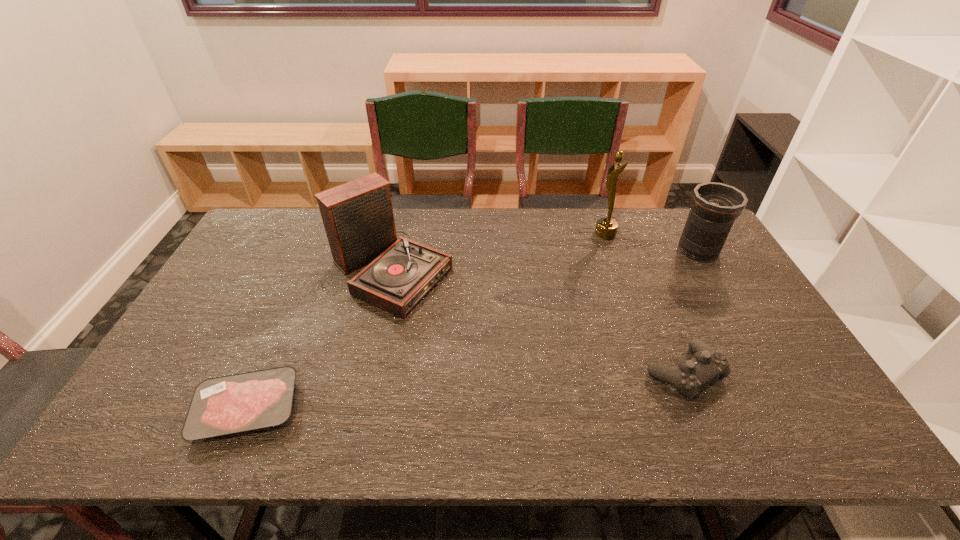
What are the coordinates of `free space located on the front of the telephoto lens` in the screenshot? It's located at (767, 368).

Where is `free space located on the back of the second shortest object`? The image size is (960, 540). free space located on the back of the second shortest object is located at coordinates (639, 265).

Identify the location of vacant region located 0.100m on the left of the shortest object. The height and width of the screenshot is (540, 960). (151, 408).

Image resolution: width=960 pixels, height=540 pixels. I want to click on award positioned at the far edge, so click(606, 228).

Identify the location of phonograph record that is positioned at the far edge. This screenshot has height=540, width=960. (358, 218).

Image resolution: width=960 pixels, height=540 pixels. I want to click on telephoto lens situated at the far edge, so click(x=715, y=206).

The height and width of the screenshot is (540, 960). Find the location of `object located at the near edge`. object located at the near edge is located at coordinates (237, 403).

I want to click on object at the left edge, so click(237, 403).

This screenshot has height=540, width=960. I want to click on object at the right edge, so click(715, 206).

This screenshot has height=540, width=960. In order to click on object at the near left corner in this screenshot , I will do `click(237, 403)`.